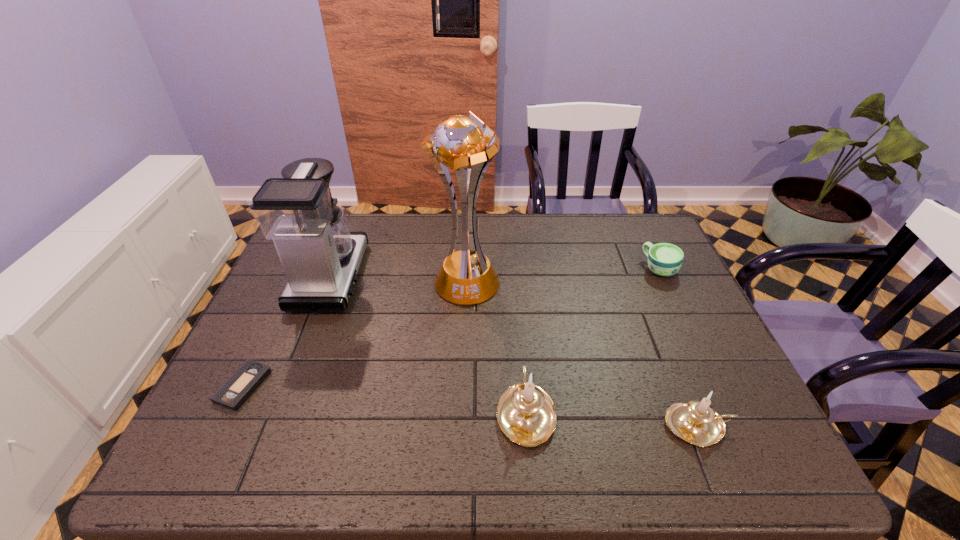
This screenshot has height=540, width=960. Find the location of `free space located 0.240m on the handle side of the third tallest object`. free space located 0.240m on the handle side of the third tallest object is located at coordinates (516, 306).

Locate an element on the screen. free space located on the handle side of the right candle holder is located at coordinates click(x=755, y=426).

I want to click on vacant area situated on the front of the fifth tallest object, so click(721, 399).

Locate an element on the screen. This screenshot has width=960, height=540. free point located on the front-facing side of the tallest object is located at coordinates (463, 365).

In order to click on free spot located at the front of the coffee maker where the controls are located in this screenshot , I will do `click(407, 277)`.

I want to click on free space located on the right of the videotape, so click(318, 386).

Where is `cup present at the far edge`? The image size is (960, 540). cup present at the far edge is located at coordinates (664, 259).

Find the location of a particular element. Image resolution: width=960 pixels, height=540 pixels. coffee maker that is at the far edge is located at coordinates (320, 256).

You are a GUI agent. You are given a task and a screenshot of the screen. Output one action in this format:
    pyautogui.click(x=<x>, y=<y>)
    Task: Click on the videotape that is positioned at the near edge
    
    Given the screenshot: What is the action you would take?
    pyautogui.click(x=234, y=392)

The image size is (960, 540). Identify the location of coffee maker at the left edge. (320, 256).